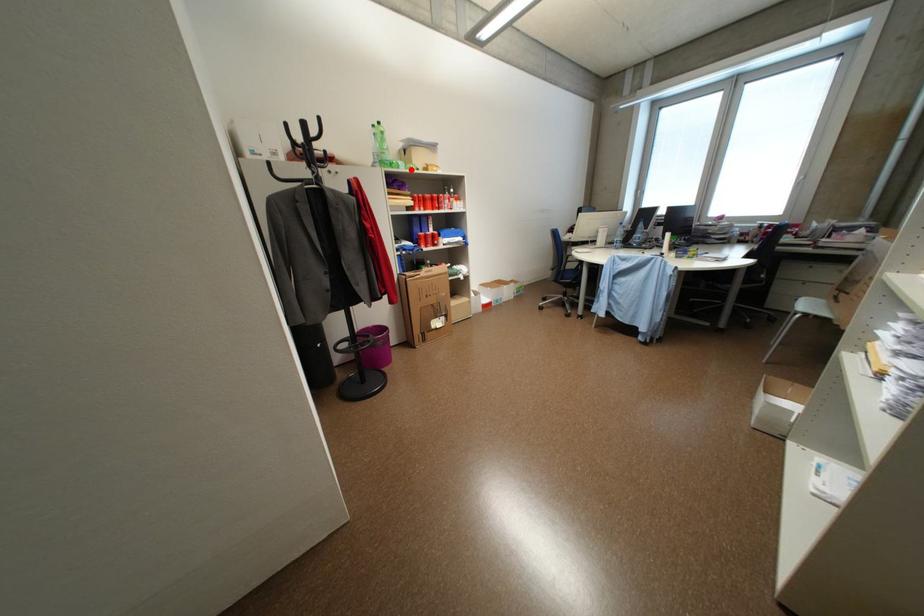
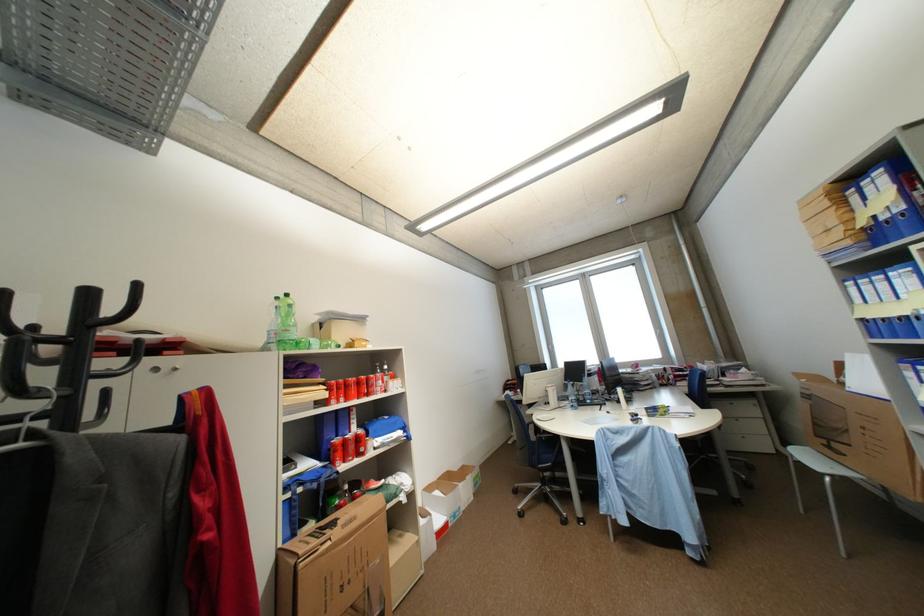
Question: I am providing you with two images of the same scene from different viewpoints. Given a red point in image1, look at the same physical point in image2. Is it:

Choices:
 (A) Closer to the viewpoint
 (B) Farther from the viewpoint

Answer: (B)